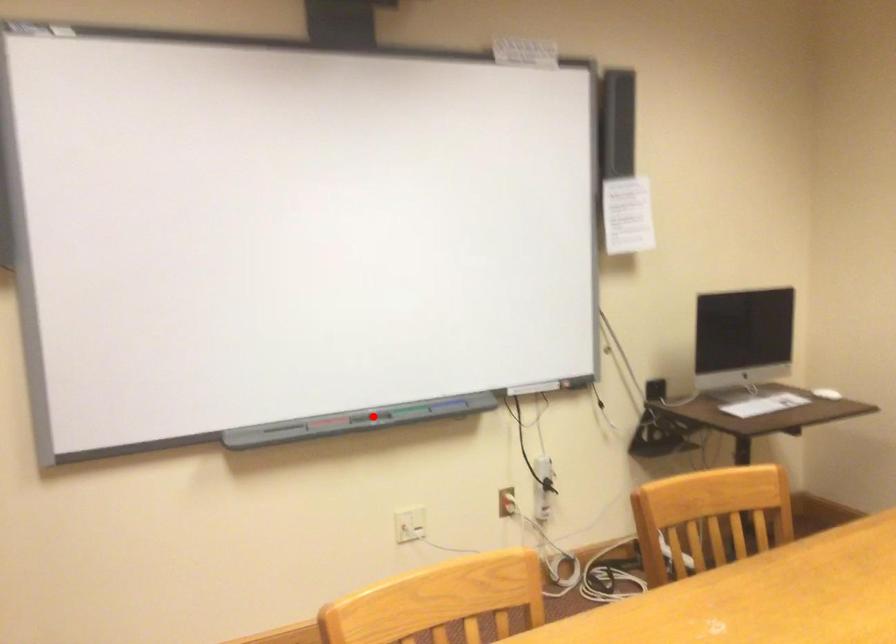
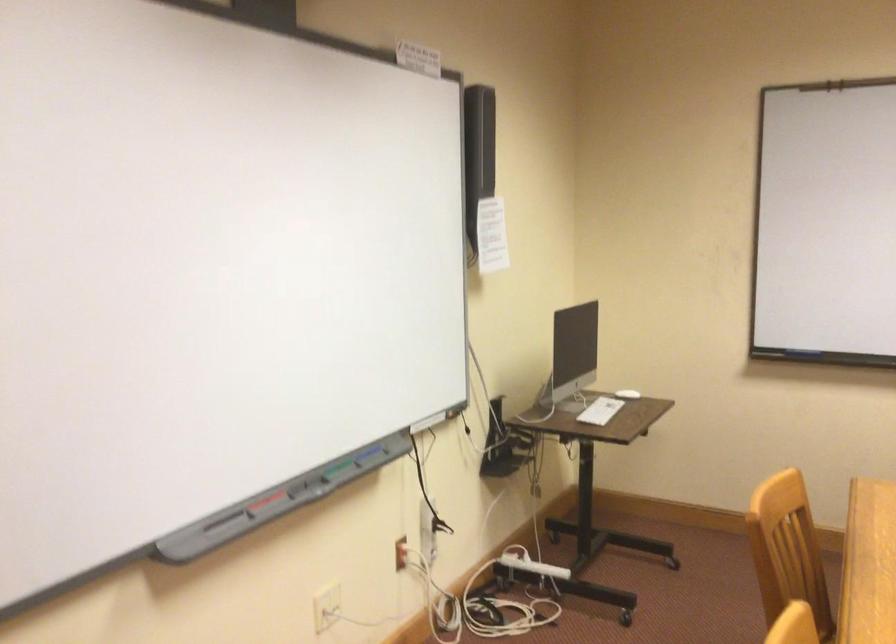
Locate, in the second image, the point that corresponds to the highlighted location in the first image.

(302, 484)